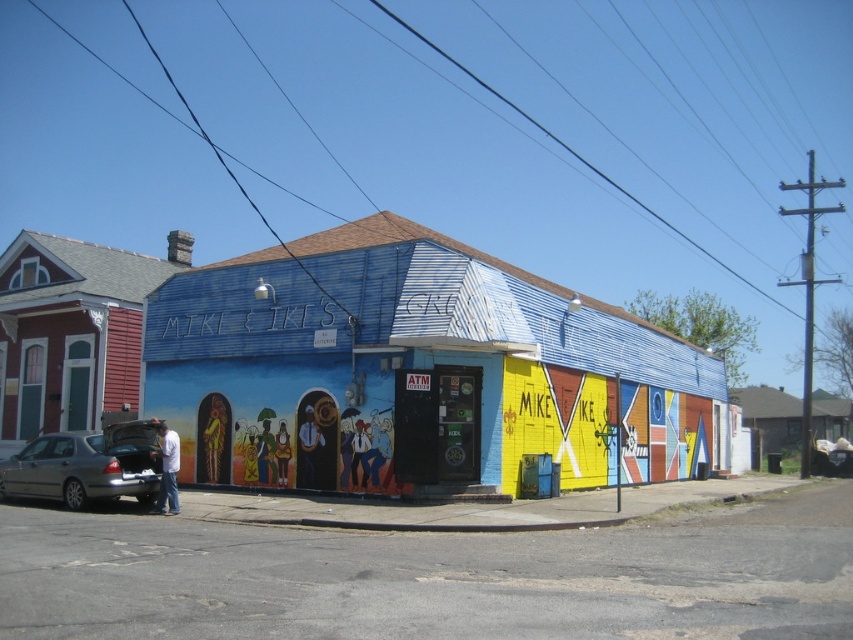
Question: Which of the following is the farthest from the observer?

Choices:
 (A) (160, 509)
 (B) (73, 509)
 (C) (230, 260)

Answer: (C)

Question: Is metallic gray sedan at lower left closer to camera compared to light blue jeans at lower left?

Choices:
 (A) yes
 (B) no

Answer: (A)

Question: Can you confirm if blue painted building at center is positioned below light blue jeans at lower left?

Choices:
 (A) yes
 (B) no

Answer: (B)

Question: Can you confirm if blue painted building at center is positioned to the right of metallic gray sedan at lower left?

Choices:
 (A) yes
 (B) no

Answer: (A)

Question: Which point is closer to the camera?

Choices:
 (A) (270, 387)
 (B) (22, 488)
 (C) (171, 506)

Answer: (C)

Question: Which of these objects is positioned closest to the light blue jeans at lower left?

Choices:
 (A) blue painted building at center
 (B) metallic gray sedan at lower left

Answer: (B)